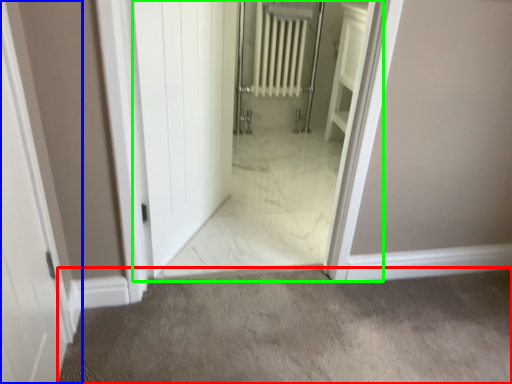
Question: Based on their relative distances, which object is nearer to granite (highlighted by a red box)? Choose from door (highlighted by a blue box) and elevator (highlighted by a green box).

Choices:
 (A) door
 (B) elevator

Answer: (A)